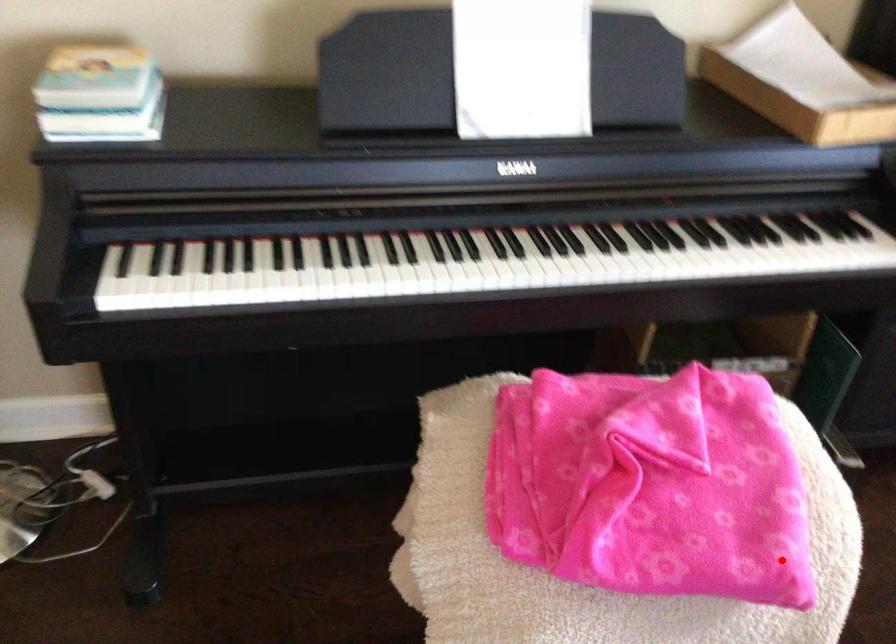
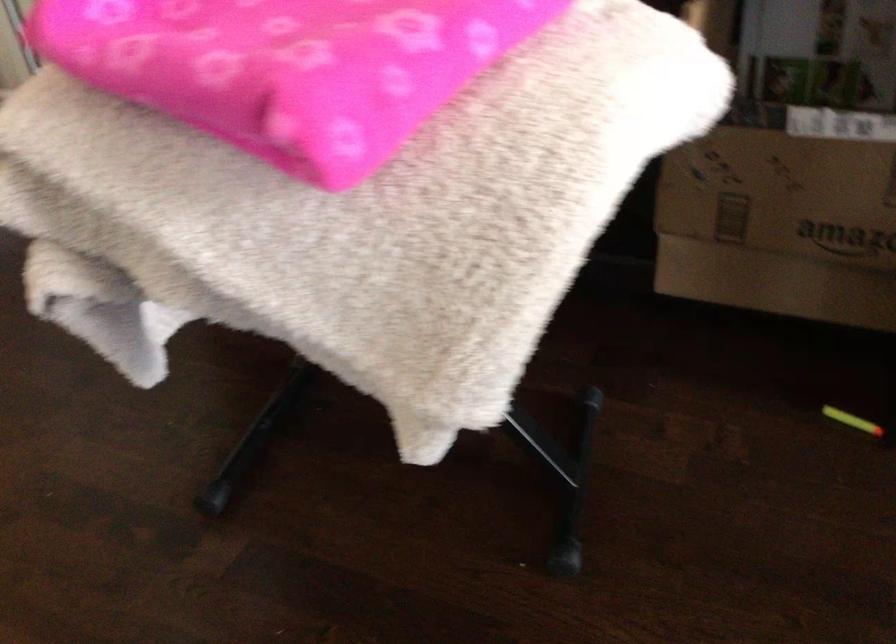
Question: A red point is marked in image1. In image2, is the corresponding 3D point closer to the camera or farther? Reply with the corresponding letter.

Choices:
 (A) The corresponding 3D point is closer.
 (B) The corresponding 3D point is farther.

Answer: (A)